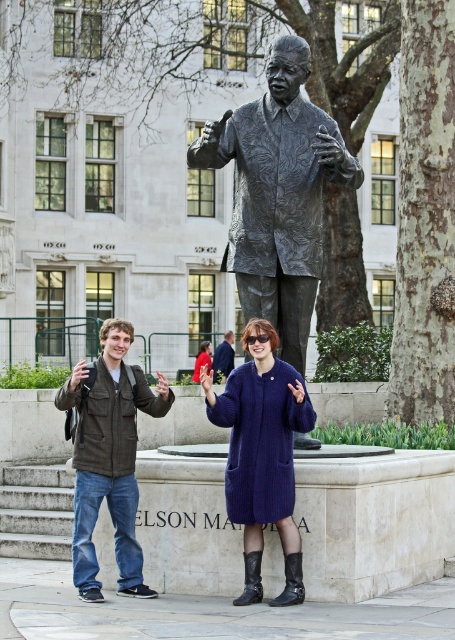
Question: Which point is farther to the camera?

Choices:
 (A) matte black jacket at center
 (B) navy wool coat at center
 (C) bronze textured statue at center

Answer: (A)

Question: Does navy wool coat at center come behind matte blue coat at center?

Choices:
 (A) no
 (B) yes

Answer: (A)

Question: Which point is farther to the camera?

Choices:
 (A) blue wool coat at center
 (B) matte blue coat at center

Answer: (B)

Question: Among these objects, which one is nearest to the camera?

Choices:
 (A) navy wool coat at center
 (B) matte blue coat at center
 (C) dark brown textured jacket at left

Answer: (A)

Question: From the image, what is the correct spatial relationship of bronze textured statue at center in relation to dark brown textured jacket at left?

Choices:
 (A) above
 (B) below

Answer: (A)

Question: Can you confirm if navy wool coat at center is positioned below matte black jacket at center?

Choices:
 (A) yes
 (B) no

Answer: (A)